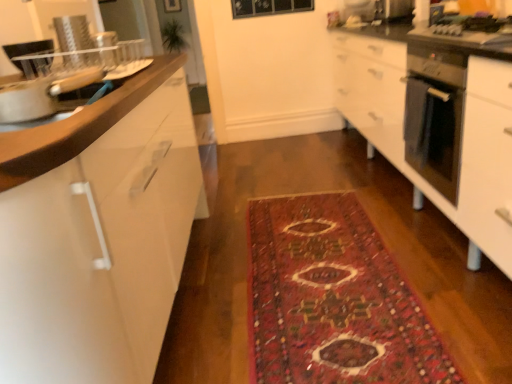
Question: From the image's perspective, does satin silver oven at right appear lower than white glossy cabinet at left?

Choices:
 (A) yes
 (B) no

Answer: (B)

Question: From a real-world perspective, is satin silver oven at right over white glossy cabinet at left?

Choices:
 (A) yes
 (B) no

Answer: (A)

Question: Is the depth of satin silver oven at right greater than that of white glossy cabinet at left?

Choices:
 (A) yes
 (B) no

Answer: (A)

Question: Does satin silver oven at right turn towards white glossy cabinet at left?

Choices:
 (A) no
 (B) yes

Answer: (B)

Question: Can you confirm if satin silver oven at right is thinner than white glossy cabinet at left?

Choices:
 (A) yes
 (B) no

Answer: (A)

Question: Is point (453, 170) closer or farther from the camera than point (177, 142)?

Choices:
 (A) closer
 (B) farther

Answer: (A)

Question: In the image, is satin silver oven at right on the left side or the right side of white glossy cabinet at left?

Choices:
 (A) left
 (B) right

Answer: (B)

Question: In the image, is satin silver oven at right positioned in front of or behind white glossy cabinet at left?

Choices:
 (A) behind
 (B) front

Answer: (A)

Question: From a real-world perspective, is satin silver oven at right positioned above or below white glossy cabinet at left?

Choices:
 (A) above
 (B) below

Answer: (A)

Question: Based on their positions, is metallic stainless steel microwave at upper right located to the left or right of satin silver oven at right?

Choices:
 (A) left
 (B) right

Answer: (B)

Question: From a real-world perspective, is metallic stainless steel microwave at upper right above or below satin silver oven at right?

Choices:
 (A) below
 (B) above

Answer: (B)

Question: From the image's perspective, is metallic stainless steel microwave at upper right above or below satin silver oven at right?

Choices:
 (A) above
 (B) below

Answer: (A)

Question: Considering their positions, is metallic stainless steel microwave at upper right located in front of or behind satin silver oven at right?

Choices:
 (A) behind
 (B) front

Answer: (A)

Question: Is white glossy cabinet at left inside the boundaries of satin silver oven at right, or outside?

Choices:
 (A) outside
 (B) inside

Answer: (A)

Question: Would you say white glossy cabinet at left is to the left or to the right of satin silver oven at right in the picture?

Choices:
 (A) right
 (B) left

Answer: (B)